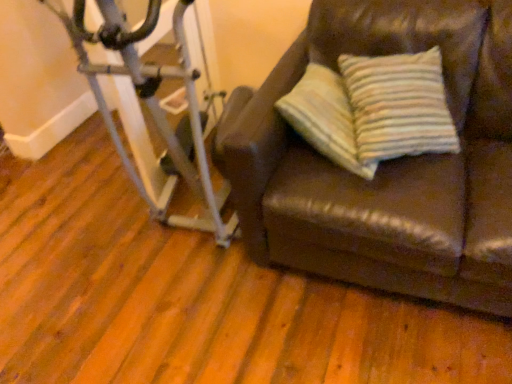
Question: From their relative heights in the image, would you say silver metallic stationary bicycle at left is taller or shorter than brown leather couch at right?

Choices:
 (A) short
 (B) tall

Answer: (B)

Question: Does point [203, 183] appear closer or farther from the camera than point [365, 243]?

Choices:
 (A) closer
 (B) farther

Answer: (B)

Question: Is silver metallic stationary bicycle at left to the left or to the right of brown leather couch at right in the image?

Choices:
 (A) left
 (B) right

Answer: (A)

Question: Considering the positions of brown leather couch at right and silver metallic stationary bicycle at left in the image, is brown leather couch at right taller or shorter than silver metallic stationary bicycle at left?

Choices:
 (A) short
 (B) tall

Answer: (A)

Question: Is brown leather couch at right spatially inside silver metallic stationary bicycle at left, or outside of it?

Choices:
 (A) outside
 (B) inside

Answer: (A)

Question: In the image, is brown leather couch at right positioned in front of or behind silver metallic stationary bicycle at left?

Choices:
 (A) front
 (B) behind

Answer: (A)

Question: Considering the relative positions of brown leather couch at right and silver metallic stationary bicycle at left in the image provided, is brown leather couch at right to the left or to the right of silver metallic stationary bicycle at left?

Choices:
 (A) left
 (B) right

Answer: (B)